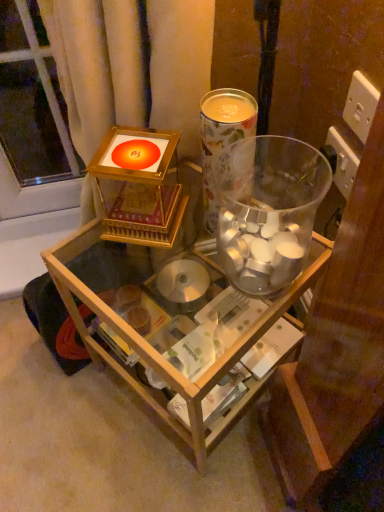
Question: Does transparent glass table at center have a greater width compared to floral paper cup at upper center, placed as the second beverage when sorted from bottom to top?

Choices:
 (A) yes
 (B) no

Answer: (A)

Question: From the image's perspective, is transparent glass table at center below floral paper cup at upper center, placed as the second beverage when sorted from bottom to top?

Choices:
 (A) yes
 (B) no

Answer: (A)

Question: Is transparent glass table at center not close to floral paper cup at upper center, placed as the second beverage when sorted from bottom to top?

Choices:
 (A) no
 (B) yes

Answer: (A)

Question: Is floral paper cup at upper center, placed as the first beverage when sorted from top to bottom, a part of transparent glass table at center?

Choices:
 (A) no
 (B) yes

Answer: (A)

Question: Is floral paper cup at upper center, placed as the second beverage when sorted from bottom to top, at the back of transparent glass table at center?

Choices:
 (A) no
 (B) yes

Answer: (A)

Question: In the image, is transparent glass vase at center, the first beverage positioned from the bottom, positioned in front of or behind floral paper cup at upper center, placed as the first beverage when sorted from top to bottom?

Choices:
 (A) front
 (B) behind

Answer: (A)

Question: From the image's perspective, relative to floral paper cup at upper center, placed as the first beverage when sorted from top to bottom, is transparent glass vase at center, the 2th beverage from the top, above or below?

Choices:
 (A) below
 (B) above

Answer: (A)

Question: Is transparent glass vase at center, the 2th beverage from the top, wider or thinner than floral paper cup at upper center, placed as the second beverage when sorted from bottom to top?

Choices:
 (A) wide
 (B) thin

Answer: (A)

Question: Looking at the image, does transparent glass vase at center, the 2th beverage from the top, seem bigger or smaller compared to floral paper cup at upper center, placed as the first beverage when sorted from top to bottom?

Choices:
 (A) small
 (B) big

Answer: (B)

Question: Is floral paper cup at upper center, placed as the second beverage when sorted from bottom to top, spatially inside transparent glass table at center, or outside of it?

Choices:
 (A) inside
 (B) outside

Answer: (B)

Question: From a real-world perspective, is floral paper cup at upper center, placed as the first beverage when sorted from top to bottom, positioned above or below transparent glass table at center?

Choices:
 (A) above
 (B) below

Answer: (A)

Question: In the image, is floral paper cup at upper center, placed as the second beverage when sorted from bottom to top, on the left side or the right side of transparent glass table at center?

Choices:
 (A) right
 (B) left

Answer: (A)

Question: From the image's perspective, is floral paper cup at upper center, placed as the first beverage when sorted from top to bottom, located above or below transparent glass table at center?

Choices:
 (A) below
 (B) above

Answer: (B)

Question: In terms of size, does floral paper cup at upper center, placed as the first beverage when sorted from top to bottom, appear bigger or smaller than transparent glass vase at center, the first beverage positioned from the bottom?

Choices:
 (A) small
 (B) big

Answer: (A)

Question: Is floral paper cup at upper center, placed as the second beverage when sorted from bottom to top, taller or shorter than transparent glass vase at center, the first beverage positioned from the bottom?

Choices:
 (A) tall
 (B) short

Answer: (A)